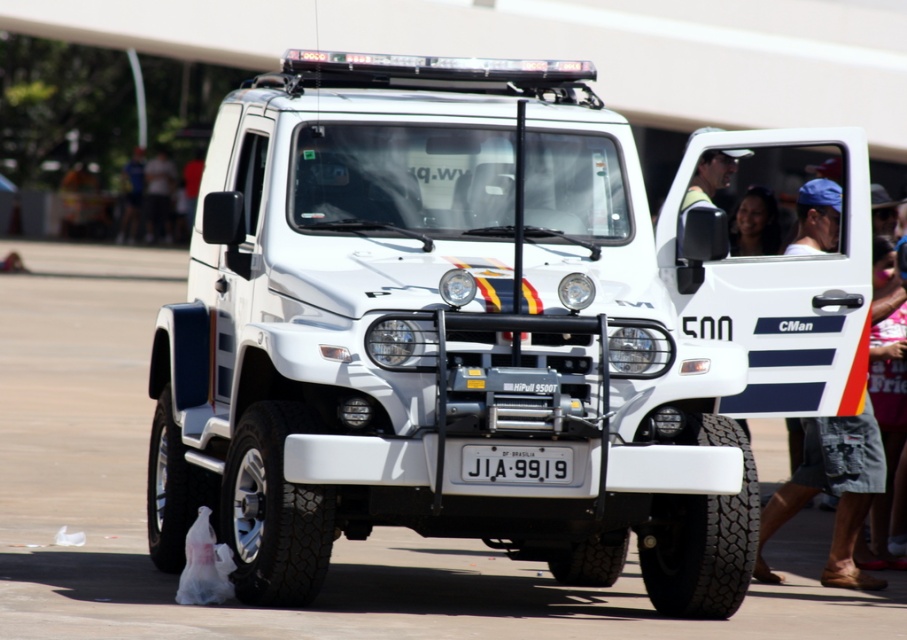
Locate an element on the screen. white matte truck at center is located at coordinates (491, 324).

Does white matte truck at center have a larger size compared to white plastic license plate at center?

Correct, white matte truck at center is larger in size than white plastic license plate at center.

You are a GUI agent. You are given a task and a screenshot of the screen. Output one action in this format:
    pyautogui.click(x=<x>, y=<y>)
    Task: Click on the white matte truck at center
    The height and width of the screenshot is (640, 907).
    Given the screenshot: What is the action you would take?
    pyautogui.click(x=491, y=324)

Does white matte truck at center have a greater height compared to blue denim shorts at right?

No, white matte truck at center is not taller than blue denim shorts at right.

What do you see at coordinates (491, 324) in the screenshot? The height and width of the screenshot is (640, 907). I see `white matte truck at center` at bounding box center [491, 324].

You are a GUI agent. You are given a task and a screenshot of the screen. Output one action in this format:
    pyautogui.click(x=<x>, y=<y>)
    Task: Click on the white matte truck at center
    
    Given the screenshot: What is the action you would take?
    pyautogui.click(x=491, y=324)

Can you confirm if blue denim shorts at right is positioned to the right of white plastic license plate at center?

Indeed, blue denim shorts at right is positioned on the right side of white plastic license plate at center.

Consider the image. Does blue denim shorts at right have a greater width compared to white plastic license plate at center?

Correct, the width of blue denim shorts at right exceeds that of white plastic license plate at center.

Consider the image. Who is more distant from viewer, (x=873, y=417) or (x=552, y=481)?

Positioned behind is point (x=873, y=417).

Where is `blue denim shorts at right`? blue denim shorts at right is located at coordinates (831, 492).